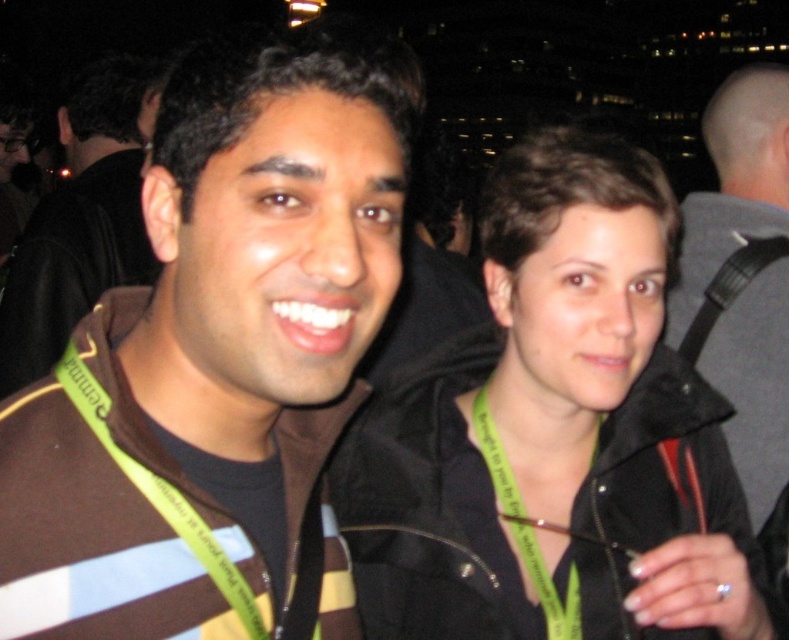
Between brown striped sweater at center and brown striped sweater at left, which one appears on the right side from the viewer's perspective?

Positioned to the right is brown striped sweater at center.

Does brown striped sweater at center have a lesser width compared to brown striped sweater at left?

Correct, brown striped sweater at center's width is less than brown striped sweater at left's.

Does point (395, 200) come farther from viewer compared to point (114, 96)?

That is False.

This screenshot has width=789, height=640. I want to click on brown striped sweater at center, so click(219, 358).

Can you confirm if brown striped sweater at left is positioned to the left of black leather strap at right?

→ Yes, brown striped sweater at left is to the left of black leather strap at right.

Is brown striped sweater at left to the right of black leather strap at right from the viewer's perspective?

Incorrect, brown striped sweater at left is not on the right side of black leather strap at right.

Describe the element at coordinates (79, 221) in the screenshot. I see `brown striped sweater at left` at that location.

Identify the location of brown striped sweater at left. The image size is (789, 640). (79, 221).

Is black matte jacket at center taller than gray fabric jacket at upper right?

Incorrect, black matte jacket at center's height is not larger of gray fabric jacket at upper right's.

This screenshot has height=640, width=789. Describe the element at coordinates (554, 435) in the screenshot. I see `black matte jacket at center` at that location.

Find the location of a particular element. The height and width of the screenshot is (640, 789). black matte jacket at center is located at coordinates (554, 435).